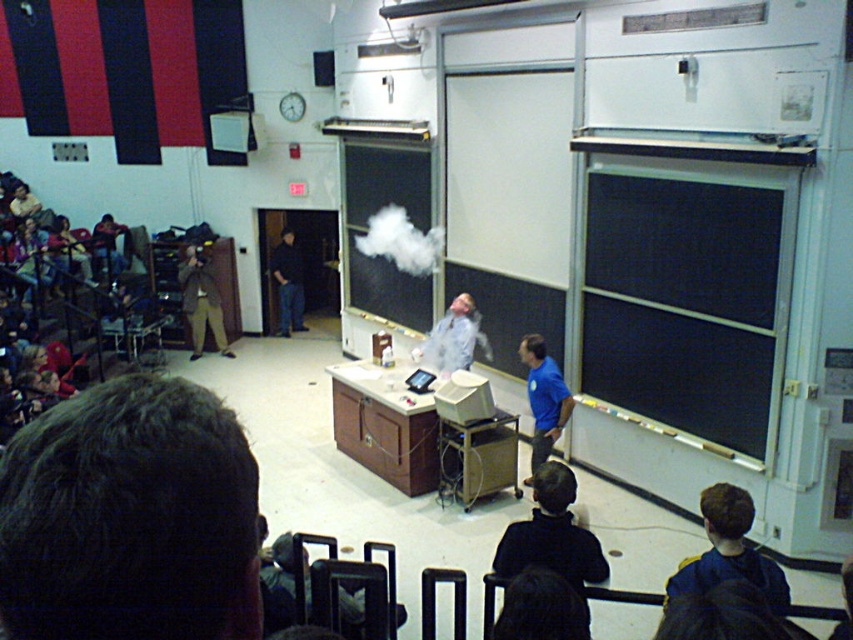
Question: Which point is farther to the camera?

Choices:
 (A) (397, 236)
 (B) (280, 304)
 (C) (610, 196)
 (D) (387, 180)

Answer: (B)

Question: Does white matte cloud at center come in front of dark blue jeans at center?

Choices:
 (A) no
 (B) yes

Answer: (B)

Question: Observing the image, what is the correct spatial positioning of white matte cloud at center in reference to white smoke at center?

Choices:
 (A) right
 (B) left

Answer: (B)

Question: Which point appears farthest from the camera in this image?

Choices:
 (A) (410, 262)
 (B) (416, 280)
 (C) (281, 317)
 (D) (601, 397)

Answer: (C)

Question: Where is white matte cloud at center located in relation to dark blue jeans at center in the image?

Choices:
 (A) above
 (B) below

Answer: (A)

Question: Which point is closer to the camera taking this photo?

Choices:
 (A) (368, 195)
 (B) (425, 262)
 (C) (299, 296)

Answer: (B)